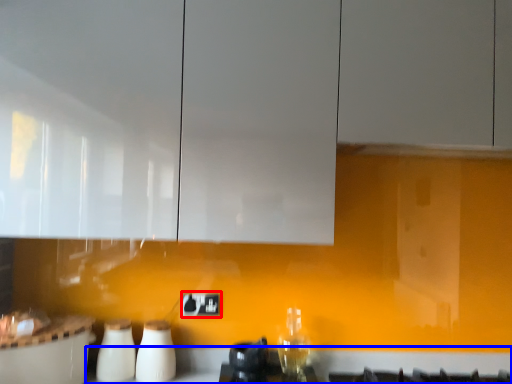
Question: Which object is closer to the camera taking this photo, electric outlet (highlighted by a red box) or counter top (highlighted by a blue box)?

Choices:
 (A) electric outlet
 (B) counter top

Answer: (B)